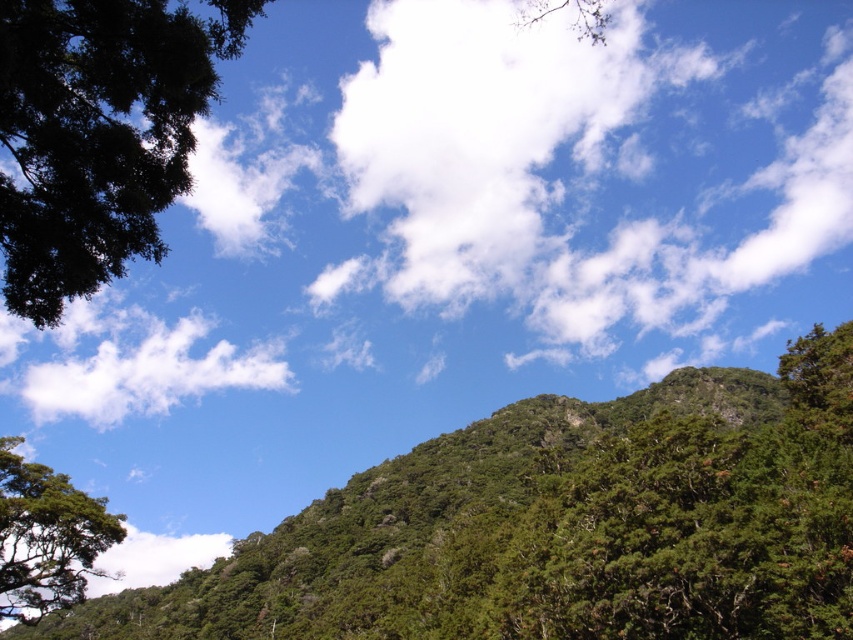
Question: Which of these objects is positioned closest to the white fluffy cloud at upper left?

Choices:
 (A) white fluffy cloud at upper center
 (B) green leafy tree at left
 (C) green leafy tree at upper left

Answer: (A)

Question: Is green leafy tree at upper left above green leafy hillside at center?

Choices:
 (A) yes
 (B) no

Answer: (A)

Question: Which object is farther from the camera taking this photo?

Choices:
 (A) green leafy tree at upper left
 (B) white fluffy cloud at upper center

Answer: (B)

Question: Does green leafy tree at upper left appear under white fluffy cloud at upper left?

Choices:
 (A) yes
 (B) no

Answer: (B)

Question: Which object is the farthest from the white fluffy cloud at upper center?

Choices:
 (A) green leafy tree at left
 (B) white fluffy cloud at lower left

Answer: (A)

Question: Observing the image, what is the correct spatial positioning of white fluffy cloud at upper center in reference to green leafy tree at upper left?

Choices:
 (A) right
 (B) left

Answer: (A)